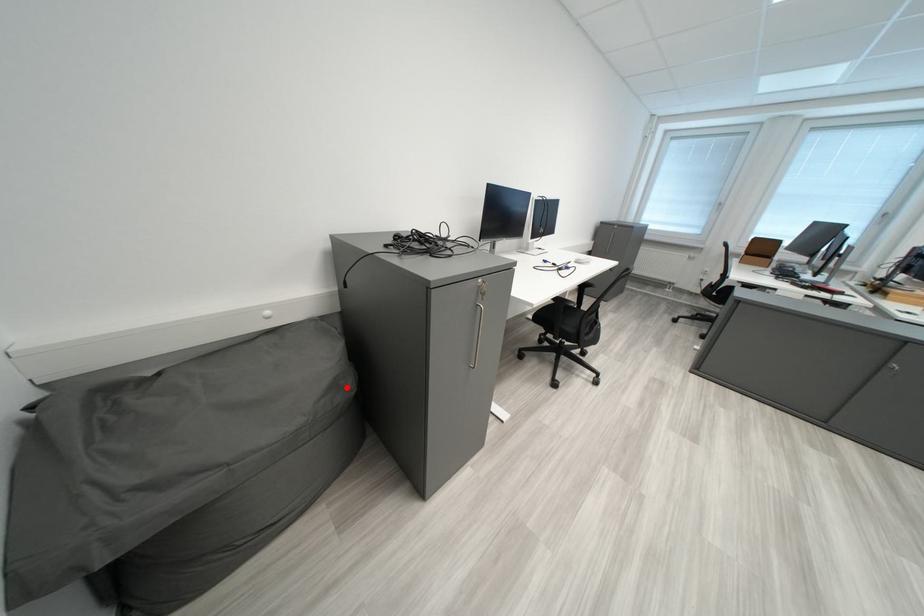
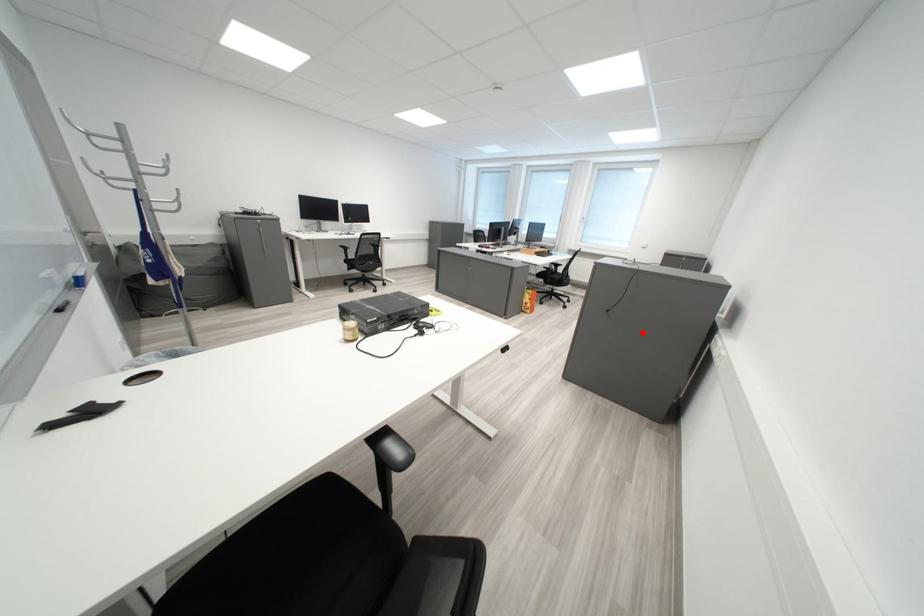
I am providing you with two images of the same scene from different viewpoints. A red point is marked on the first image and another point is marked on the second image. Is the marked point in image1 the same physical position as the marked point in image2?

No